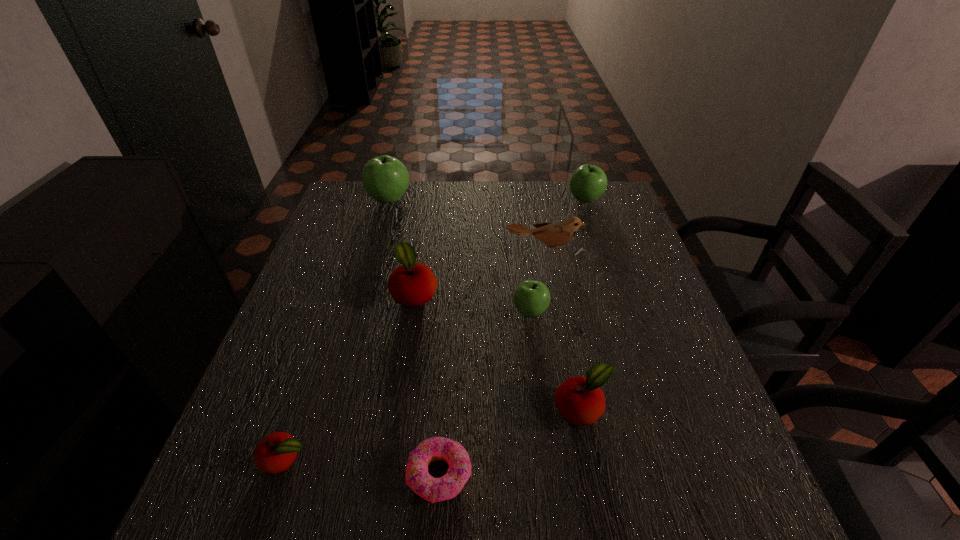
The image size is (960, 540). What are the coordinates of `free region at the left edge` in the screenshot? It's located at (324, 261).

Image resolution: width=960 pixels, height=540 pixels. I want to click on vacant space at the right edge of the desktop, so (636, 241).

In the image, there is a desktop. Where is `vacant space at the far left corner`? Image resolution: width=960 pixels, height=540 pixels. vacant space at the far left corner is located at coordinates (361, 205).

Find the location of a particular element. The height and width of the screenshot is (540, 960). vacant region at the near left corner is located at coordinates (201, 504).

Identify the location of free space at the far right corner of the desktop. Image resolution: width=960 pixels, height=540 pixels. (575, 201).

In order to click on vacant space at the near right corner of the desktop in this screenshot , I will do `click(712, 531)`.

This screenshot has height=540, width=960. Identify the location of vacant point located between the bird and the biggest red apple. (480, 272).

Locate an element on the screen. The width and height of the screenshot is (960, 540). blank region between the rightmost apple and the nearest green apple is located at coordinates (558, 256).

The image size is (960, 540). In order to click on unoccupied area between the nearest apple and the biggest red apple in this screenshot , I will do `click(350, 375)`.

I want to click on free space between the smallest green apple and the shortest apple, so click(x=408, y=386).